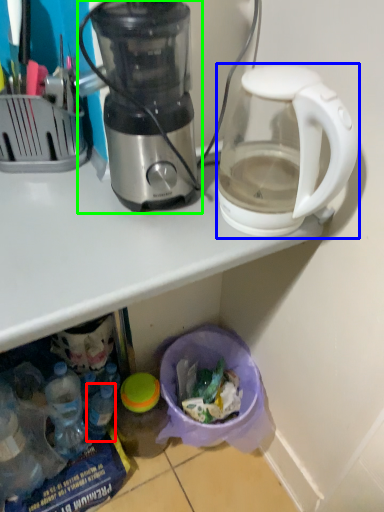
Question: Which object is the closest to the bottle (highlighted by a red box)? Choose among these: coffee maker (highlighted by a blue box) or blender (highlighted by a green box).

Choices:
 (A) coffee maker
 (B) blender

Answer: (B)